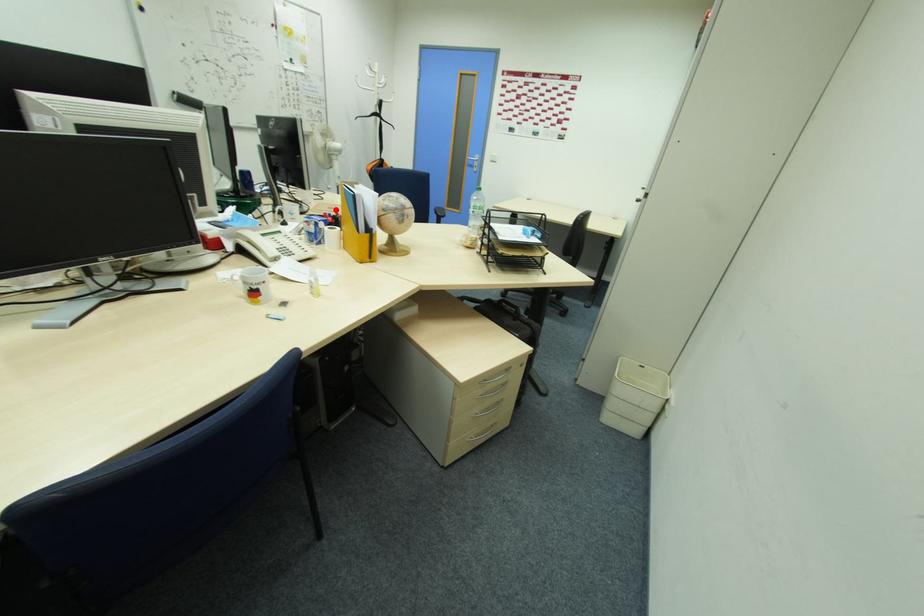
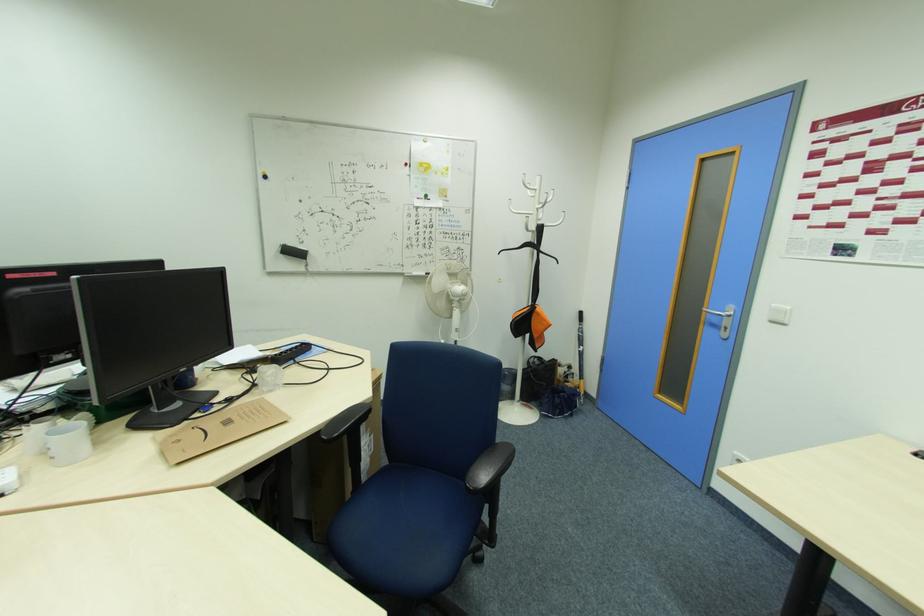
Question: I am providing you with two images of the same scene from different viewpoints. Image1 has a red point marked. In image2, the corresponding 3D location appears at what relative position? Reply with the corresponding letter.

Choices:
 (A) Closer
 (B) Farther

Answer: (A)